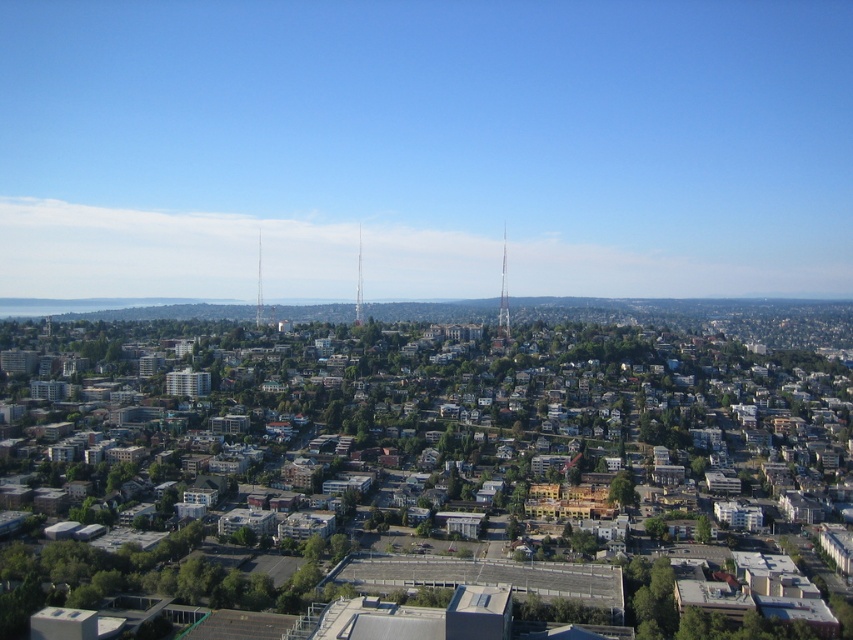
Is metallic silver tower at center taller than silver metallic tower at center?

Indeed, metallic silver tower at center has a greater height compared to silver metallic tower at center.

Can you confirm if metallic silver tower at center is wider than silver metallic tower at center?

No.

Is point (357, 268) in front of point (258, 289)?

Yes, point (357, 268) is closer to viewer.

Identify the location of metallic silver tower at center. point(358,284).

Where is `smooth glass tower at center`? smooth glass tower at center is located at coordinates (503, 298).

Is smooth glass tower at center wider than silver metallic tower at center?

Indeed, smooth glass tower at center has a greater width compared to silver metallic tower at center.

Measure the distance between point (503, 230) and camera.

634.18 meters

You are a GUI agent. You are given a task and a screenshot of the screen. Output one action in this format:
    pyautogui.click(x=<x>, y=<y>)
    Task: Click on the smooth glass tower at center
    The image size is (853, 640).
    Given the screenshot: What is the action you would take?
    pyautogui.click(x=503, y=298)

Is smooth glass tower at center smaller than metallic silver tower at center?

No, smooth glass tower at center is not smaller than metallic silver tower at center.

Image resolution: width=853 pixels, height=640 pixels. Identify the location of smooth glass tower at center. (503, 298).

This screenshot has width=853, height=640. Describe the element at coordinates (503, 298) in the screenshot. I see `smooth glass tower at center` at that location.

At what (x,y) coordinates should I click in order to perform the action: click on smooth glass tower at center. Please return your answer as a coordinate pair (x, y). Image resolution: width=853 pixels, height=640 pixels. Looking at the image, I should click on (503, 298).